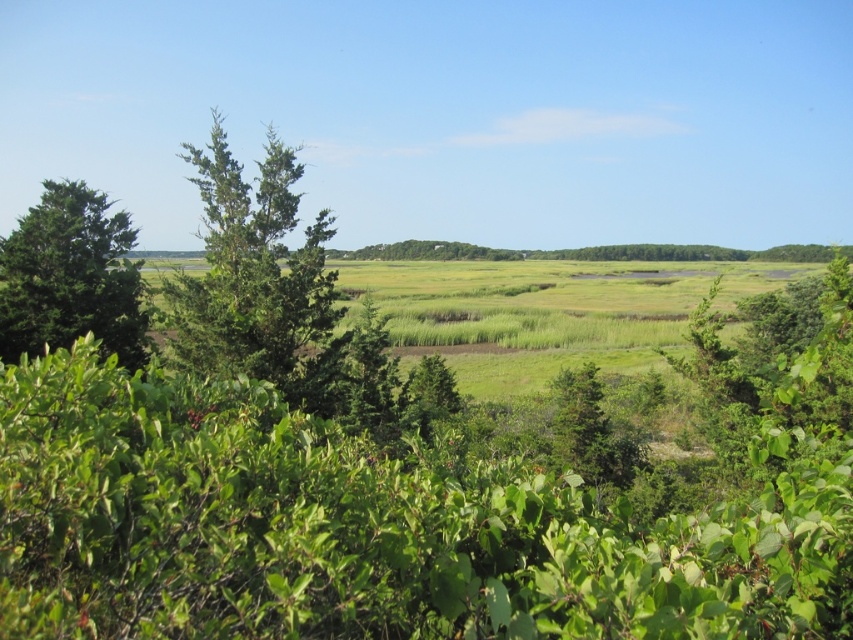
How much distance is there between green textured tree at left and green leafy tree at left?

green textured tree at left and green leafy tree at left are 4.25 meters apart from each other.

Does green textured tree at left appear under green leafy tree at left?

Actually, green textured tree at left is above green leafy tree at left.

Which is in front, point (329, 230) or point (1, 266)?

Positioned in front is point (1, 266).

You are a GUI agent. You are given a task and a screenshot of the screen. Output one action in this format:
    pyautogui.click(x=<x>, y=<y>)
    Task: Click on the green textured tree at left
    This screenshot has width=853, height=640.
    Given the screenshot: What is the action you would take?
    pyautogui.click(x=257, y=276)